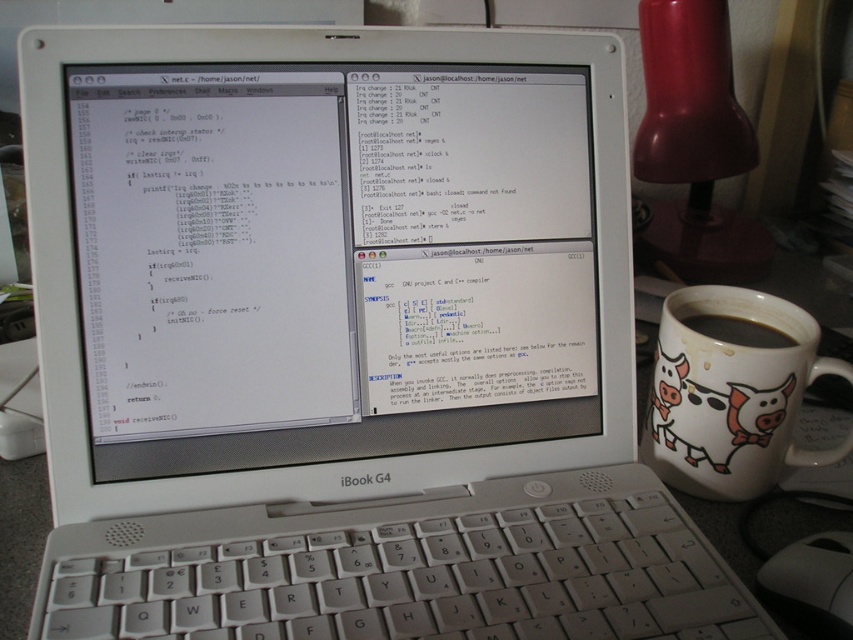
You are a person with a 12.5 inch long ruler. You want to measure the distance between yourself and the white plastic keyboard at center. Can your ruler reach that distance?

The distance between the white plastic keyboard at center and the viewer is 13.14 inches. Since your ruler is only 12.5 inches long, it cannot fully measure the distance as it is shorter than the required length.

You are trying to reach for the black matte mug at right while your hand is currently resting on the white plastic keyboard at center. Based on the scene, can you safely grab the mug without moving your hand more than 10 inches?

The white plastic keyboard at center is 9.09 inches from the black matte mug at right, so yes, you can safely grab the mug without moving your hand more than 10 inches since the distance is within the limit.

You are a programmer working on an Apple iBook G4. You need to check the terminal output on the white glossy computer screen at center and grab your black matte mug at right for a coffee break. Based on their positions, which object is located to the east of the other?

The white glossy computer screen at center is to the left of the black matte mug at right, so the black matte mug at right is located to the east of the white glossy computer screen at center.